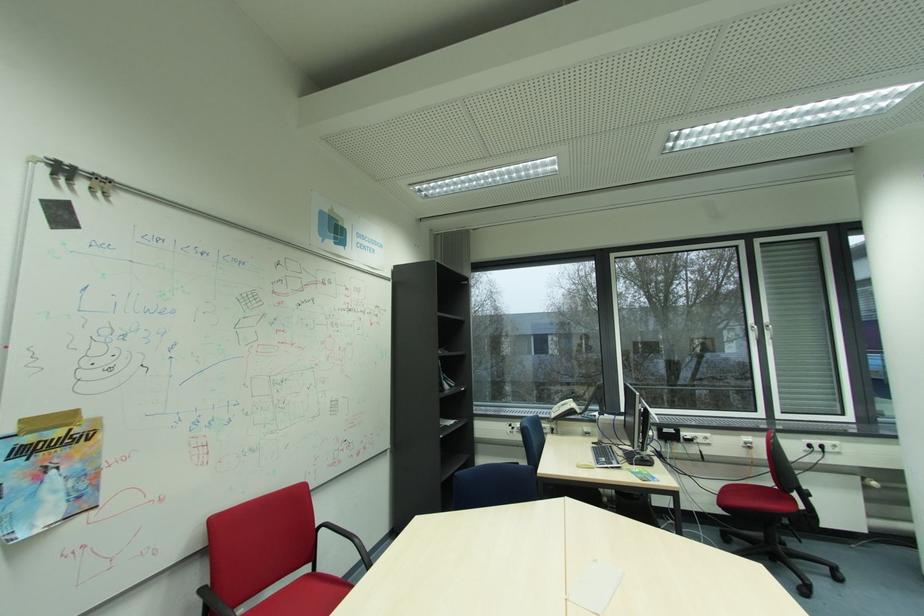
The width and height of the screenshot is (924, 616). Describe the element at coordinates (768, 330) in the screenshot. I see `the white window handle` at that location.